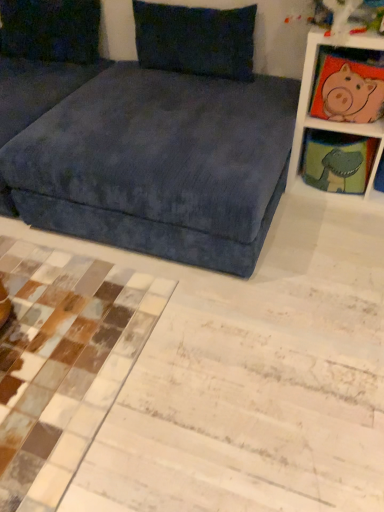
The height and width of the screenshot is (512, 384). Describe the element at coordinates (352, 97) in the screenshot. I see `pink fabric pig at upper right` at that location.

Describe the element at coordinates (337, 161) in the screenshot. I see `matte green fabric at upper right, which is counted as the second shelf, starting from the top` at that location.

In order to face matte green fabric at upper right, acting as the first shelf starting from the bottom, should I rotate leftwards or rightwards?

You should look right and rotate roughly 18.992 degrees.

Where is `pink fabric pig at upper right`? Image resolution: width=384 pixels, height=512 pixels. pink fabric pig at upper right is located at coordinates (352, 97).

In terms of size, does velvet blue studio couch at upper center appear bigger or smaller than matte green fabric at upper right, which is counted as the second shelf, starting from the top?

velvet blue studio couch at upper center is bigger than matte green fabric at upper right, which is counted as the second shelf, starting from the top.

Is velvet blue studio couch at upper center not inside matte green fabric at upper right, acting as the first shelf starting from the bottom?

That's correct, velvet blue studio couch at upper center is outside of matte green fabric at upper right, acting as the first shelf starting from the bottom.

Considering the positions of objects velvet blue studio couch at upper center and matte green fabric at upper right, acting as the first shelf starting from the bottom, in the image provided, who is in front, velvet blue studio couch at upper center or matte green fabric at upper right, acting as the first shelf starting from the bottom,?

velvet blue studio couch at upper center is in front.

Is velvet blue studio couch at upper center shorter than matte green fabric at upper right, acting as the first shelf starting from the bottom?

No.

Does matte green fabric at upper right, acting as the first shelf starting from the bottom, touch velvet blue studio couch at upper center?

There is a gap between matte green fabric at upper right, acting as the first shelf starting from the bottom, and velvet blue studio couch at upper center.

Is matte green fabric at upper right, acting as the first shelf starting from the bottom, facing away from velvet blue studio couch at upper center?

No, matte green fabric at upper right, acting as the first shelf starting from the bottom, is not facing away from velvet blue studio couch at upper center.

Is matte green fabric at upper right, which is counted as the second shelf, starting from the top, not within velvet blue studio couch at upper center?

Yes, matte green fabric at upper right, which is counted as the second shelf, starting from the top, is not within velvet blue studio couch at upper center.

From a real-world perspective, does matte green fabric at upper right, acting as the first shelf starting from the bottom, sit lower than velvet blue studio couch at upper center?

Yes, from a real-world perspective, matte green fabric at upper right, acting as the first shelf starting from the bottom, is below velvet blue studio couch at upper center.

Can you confirm if matte green fabric at upper right, acting as the first shelf starting from the bottom, is wider than white wood shelf at upper right, placed as the first shelf when sorted from top to bottom?

Incorrect, the width of matte green fabric at upper right, acting as the first shelf starting from the bottom, does not surpass that of white wood shelf at upper right, placed as the first shelf when sorted from top to bottom.

Is matte green fabric at upper right, acting as the first shelf starting from the bottom, beside white wood shelf at upper right, placed as the first shelf when sorted from top to bottom?

No, matte green fabric at upper right, acting as the first shelf starting from the bottom, is not next to white wood shelf at upper right, placed as the first shelf when sorted from top to bottom.

Considering the sizes of matte green fabric at upper right, acting as the first shelf starting from the bottom, and white wood shelf at upper right, marked as the second shelf in a bottom-to-top arrangement, in the image, is matte green fabric at upper right, acting as the first shelf starting from the bottom, bigger or smaller than white wood shelf at upper right, marked as the second shelf in a bottom-to-top arrangement,?

In the image, matte green fabric at upper right, acting as the first shelf starting from the bottom, appears to be smaller than white wood shelf at upper right, marked as the second shelf in a bottom-to-top arrangement.

Is matte green fabric at upper right, which is counted as the second shelf, starting from the top, aimed at white wood shelf at upper right, marked as the second shelf in a bottom-to-top arrangement?

Yes, matte green fabric at upper right, which is counted as the second shelf, starting from the top, is turned towards white wood shelf at upper right, marked as the second shelf in a bottom-to-top arrangement.

Is matte green fabric at upper right, acting as the first shelf starting from the bottom, surrounded by velvet dark blue pillow at upper left, positioned as the 1th pillow in left-to-right order?

That's incorrect, matte green fabric at upper right, acting as the first shelf starting from the bottom, is not inside velvet dark blue pillow at upper left, positioned as the 1th pillow in left-to-right order.

Can you confirm if velvet dark blue pillow at upper left, positioned as the 1th pillow in left-to-right order, is shorter than matte green fabric at upper right, which is counted as the second shelf, starting from the top?

No.

Between velvet dark blue pillow at upper left, which is counted as the 2th pillow, starting from the right, and matte green fabric at upper right, which is counted as the second shelf, starting from the top, which one appears on the left side from the viewer's perspective?

From the viewer's perspective, velvet dark blue pillow at upper left, which is counted as the 2th pillow, starting from the right, appears more on the left side.

Could you tell me if velvet dark blue pillow at upper left, which is counted as the 2th pillow, starting from the right, is facing matte green fabric at upper right, acting as the first shelf starting from the bottom?

No, velvet dark blue pillow at upper left, which is counted as the 2th pillow, starting from the right, is not oriented towards matte green fabric at upper right, acting as the first shelf starting from the bottom.

Who is smaller, velvet dark blue pillow at upper left, positioned as the 1th pillow in left-to-right order, or pink fabric pig at upper right?

pink fabric pig at upper right is smaller.

Does velvet dark blue pillow at upper left, positioned as the 1th pillow in left-to-right order, appear on the left side of pink fabric pig at upper right?

Indeed, velvet dark blue pillow at upper left, positioned as the 1th pillow in left-to-right order, is positioned on the left side of pink fabric pig at upper right.

Is velvet dark blue pillow at upper left, positioned as the 1th pillow in left-to-right order, touching pink fabric pig at upper right?

They are not placed beside each other.

Starting from the pink fabric pig at upper right, which pillow is the 2nd one behind? Please provide its 2D coordinates.

[(51, 29)]

How many degrees apart are the facing directions of velvet dark blue pillow at upper left, positioned as the 1th pillow in left-to-right order, and velvet blue studio couch at upper center?

The facing directions of velvet dark blue pillow at upper left, positioned as the 1th pillow in left-to-right order, and velvet blue studio couch at upper center are 89.1 degrees apart.

Is velvet dark blue pillow at upper left, positioned as the 1th pillow in left-to-right order, situated inside velvet blue studio couch at upper center or outside?

velvet dark blue pillow at upper left, positioned as the 1th pillow in left-to-right order, is inside velvet blue studio couch at upper center.

Considering the relative sizes of velvet dark blue pillow at upper left, which is counted as the 2th pillow, starting from the right, and velvet blue studio couch at upper center in the image provided, is velvet dark blue pillow at upper left, which is counted as the 2th pillow, starting from the right, bigger than velvet blue studio couch at upper center?

Actually, velvet dark blue pillow at upper left, which is counted as the 2th pillow, starting from the right, might be smaller than velvet blue studio couch at upper center.

Which object is more forward, velvet dark blue pillow at upper left, positioned as the 1th pillow in left-to-right order, or velvet blue studio couch at upper center?

Positioned in front is velvet blue studio couch at upper center.

Locate an element on the screen. This screenshot has height=512, width=384. animal on the right of velvety dark blue pillow at upper center, marked as the 2th pillow in a left-to-right arrangement is located at coordinates (352, 97).

Does pink fabric pig at upper right contain velvety dark blue pillow at upper center, marked as the 2th pillow in a left-to-right arrangement?

That's incorrect, velvety dark blue pillow at upper center, marked as the 2th pillow in a left-to-right arrangement, is not inside pink fabric pig at upper right.

Is pink fabric pig at upper right taller than velvety dark blue pillow at upper center, marked as the 2th pillow in a left-to-right arrangement?

No, pink fabric pig at upper right is not taller than velvety dark blue pillow at upper center, marked as the 2th pillow in a left-to-right arrangement.

Is pink fabric pig at upper right positioned with its back to velvety dark blue pillow at upper center, marked as the 2th pillow in a left-to-right arrangement?

No, velvety dark blue pillow at upper center, marked as the 2th pillow in a left-to-right arrangement, is not at the back of pink fabric pig at upper right.

From the image's perspective, which shelf is the 1st one above the velvet blue studio couch at upper center? Please provide its 2D coordinates.

[(337, 161)]

The image size is (384, 512). What are the coordinates of `studio couch in front of the matte green fabric at upper right, which is counted as the second shelf, starting from the top` in the screenshot? It's located at (162, 156).

When comparing their distances from matte green fabric at upper right, acting as the first shelf starting from the bottom, does white wood shelf at upper right, marked as the second shelf in a bottom-to-top arrangement, or pink fabric pig at upper right seem closer?

Based on the image, white wood shelf at upper right, marked as the second shelf in a bottom-to-top arrangement, appears to be nearer to matte green fabric at upper right, acting as the first shelf starting from the bottom.

Looking at the image, which one is located further to pink fabric pig at upper right, white wood shelf at upper right, marked as the second shelf in a bottom-to-top arrangement, or matte green fabric at upper right, acting as the first shelf starting from the bottom?

matte green fabric at upper right, acting as the first shelf starting from the bottom, is further to pink fabric pig at upper right.

Considering their positions, is velvety dark blue pillow at upper center, marked as the 2th pillow in a left-to-right arrangement, positioned further to velvet dark blue pillow at upper left, which is counted as the 2th pillow, starting from the right, than velvet blue studio couch at upper center?

Among the two, velvet blue studio couch at upper center is located further to velvet dark blue pillow at upper left, which is counted as the 2th pillow, starting from the right.

Looking at the image, which one is located further to matte green fabric at upper right, which is counted as the second shelf, starting from the top, velvet dark blue pillow at upper left, positioned as the 1th pillow in left-to-right order, or white wood shelf at upper right, placed as the first shelf when sorted from top to bottom?

Based on the image, velvet dark blue pillow at upper left, positioned as the 1th pillow in left-to-right order, appears to be further to matte green fabric at upper right, which is counted as the second shelf, starting from the top.

Considering their positions, is pink fabric pig at upper right positioned closer to white wood shelf at upper right, marked as the second shelf in a bottom-to-top arrangement, than velvet blue studio couch at upper center?

Among the two, pink fabric pig at upper right is located nearer to white wood shelf at upper right, marked as the second shelf in a bottom-to-top arrangement.

When comparing their distances from pink fabric pig at upper right, does velvet blue studio couch at upper center or white wood shelf at upper right, placed as the first shelf when sorted from top to bottom, seem further?

velvet blue studio couch at upper center.

Looking at this image, looking at the image, which one is located further to velvet blue studio couch at upper center, pink fabric pig at upper right or velvety dark blue pillow at upper center, marked as the 2th pillow in a left-to-right arrangement?

Based on the image, pink fabric pig at upper right appears to be further to velvet blue studio couch at upper center.

Looking at the image, which one is located further to pink fabric pig at upper right, velvety dark blue pillow at upper center, the first pillow from the right, or velvet blue studio couch at upper center?

Based on the image, velvet blue studio couch at upper center appears to be further to pink fabric pig at upper right.

Where is `shelf situated between velvety dark blue pillow at upper center, marked as the 2th pillow in a left-to-right arrangement, and white wood shelf at upper right, marked as the second shelf in a bottom-to-top arrangement, from left to right`? Image resolution: width=384 pixels, height=512 pixels. shelf situated between velvety dark blue pillow at upper center, marked as the 2th pillow in a left-to-right arrangement, and white wood shelf at upper right, marked as the second shelf in a bottom-to-top arrangement, from left to right is located at coordinates (337, 161).

Locate an element on the screen. The height and width of the screenshot is (512, 384). shelf between velvet blue studio couch at upper center and matte green fabric at upper right, acting as the first shelf starting from the bottom, in the front-back direction is located at coordinates (325, 120).

The width and height of the screenshot is (384, 512). What are the coordinates of `pillow located between velvet blue studio couch at upper center and velvet dark blue pillow at upper left, positioned as the 1th pillow in left-to-right order, in the depth direction` in the screenshot? It's located at (195, 39).

The width and height of the screenshot is (384, 512). What are the coordinates of `animal located between velvet blue studio couch at upper center and velvety dark blue pillow at upper center, the first pillow from the right, in the depth direction` in the screenshot? It's located at (352, 97).